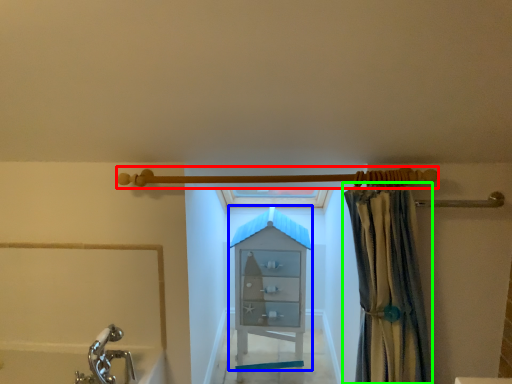
Question: Considering the real-world distances, which object is closest to shower (highlighted by a red box)? cabinet (highlighted by a blue box) or curtain (highlighted by a green box).

Choices:
 (A) cabinet
 (B) curtain

Answer: (B)